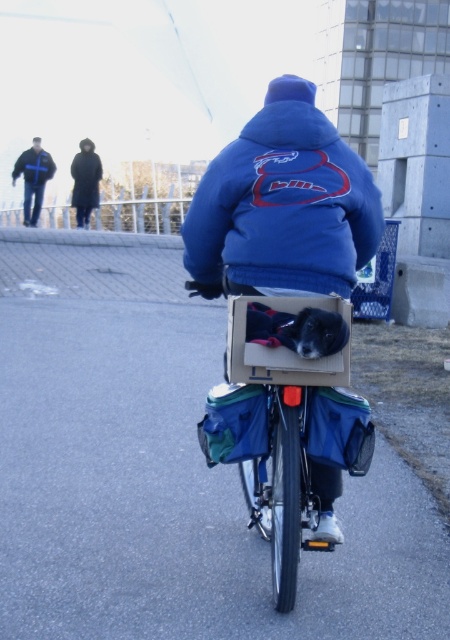
Question: Can you confirm if cardboard box at center is positioned to the right of blue fleece jacket at upper left?

Choices:
 (A) no
 (B) yes

Answer: (B)

Question: From the image, what is the correct spatial relationship of cardboard box at center in relation to puffy blue jacket at center?

Choices:
 (A) below
 (B) above

Answer: (A)

Question: Which point appears farthest from the camera in this image?

Choices:
 (A) (31, 164)
 (B) (283, 472)
 (C) (341, 161)
 (D) (49, 173)

Answer: (D)

Question: Which point is farther to the camera?

Choices:
 (A) (32, 160)
 (B) (277, 193)
 (C) (18, 157)

Answer: (C)

Question: Can you confirm if puffy blue jacket at center is positioned below blue fleece jacket at upper center?

Choices:
 (A) yes
 (B) no

Answer: (A)

Question: Among these objects, which one is farthest from the camera?

Choices:
 (A) cardboard box at center
 (B) blue fleece jacket at upper center
 (C) blue fleece jacket at upper left
 (D) blue fleece jacket at center

Answer: (B)